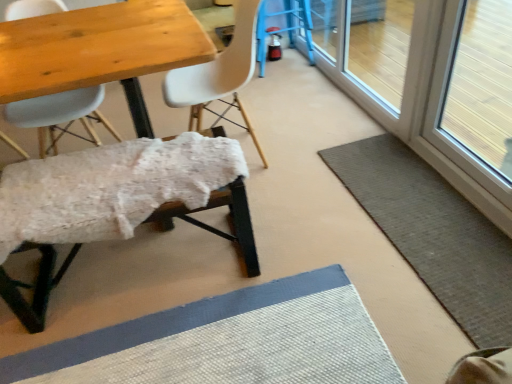
This screenshot has height=384, width=512. What do you see at coordinates (385, 63) in the screenshot?
I see `transparent glass screen door at upper right` at bounding box center [385, 63].

Identify the location of matte white chair at upper left, the third chair when ordered from right to left. (60, 116).

Measure the distance between point (20, 116) and camera.

Point (20, 116) and camera are 1.88 meters apart.

The width and height of the screenshot is (512, 384). In order to click on white fluffy bench at lower left, placed as the 2th chair when sorted from right to left in this screenshot , I will do `click(215, 228)`.

The image size is (512, 384). I want to click on transparent glass window screen at right, so click(x=475, y=94).

The height and width of the screenshot is (384, 512). What do you see at coordinates (433, 233) in the screenshot?
I see `gray woven bath mat at lower right` at bounding box center [433, 233].

Measure the distance between gray woven bath mat at lower right and camera.

A distance of 4.31 feet exists between gray woven bath mat at lower right and camera.

Measure the distance between point (302, 17) and camera.

→ Point (302, 17) and camera are 10.10 feet apart.

Image resolution: width=512 pixels, height=384 pixels. I want to click on blue plastic bar stool at upper right, so click(284, 28).

Find the location of `transparent glass screen door at upper right`. transparent glass screen door at upper right is located at coordinates (385, 63).

Does point (501, 81) appear closer or farther from the camera than point (49, 95)?

Point (501, 81) appears to be farther away from the viewer than point (49, 95).

Consider the image. Would you say transparent glass window screen at right contains matte white chair at upper left, the third chair when ordered from right to left?

No, matte white chair at upper left, the third chair when ordered from right to left, is not a part of transparent glass window screen at right.

From a real-world perspective, who is located lower, transparent glass window screen at right or matte white chair at upper left, marked as the 1th chair in a left-to-right arrangement?

transparent glass window screen at right, from a real-world perspective.

Which is behind, transparent glass window screen at right or matte white chair at upper left, the third chair when ordered from right to left?

matte white chair at upper left, the third chair when ordered from right to left, is behind.

Does transparent glass window screen at right come behind gray woven bath mat at lower right?

No.

Is transparent glass window screen at right smaller than gray woven bath mat at lower right?

No, transparent glass window screen at right is not smaller than gray woven bath mat at lower right.

Which is in front, point (434, 130) or point (328, 148)?

The point (434, 130) is closer to the camera.

Is gray woven bath mat at lower right surrounded by transparent glass window screen at right?

No, gray woven bath mat at lower right is not surrounded by transparent glass window screen at right.

Is blue plastic bar stool at upper right directly adjacent to white fluffy bench at lower left, placed as the 2th chair when sorted from right to left?

No, blue plastic bar stool at upper right is not next to white fluffy bench at lower left, placed as the 2th chair when sorted from right to left.

From the image's perspective, would you say blue plastic bar stool at upper right is shown under white fluffy bench at lower left, the second chair when ordered from left to right?

Actually, blue plastic bar stool at upper right appears above white fluffy bench at lower left, the second chair when ordered from left to right, in the image.

Considering the positions of objects blue plastic bar stool at upper right and white fluffy bench at lower left, the second chair when ordered from left to right, in the image provided, who is in front, blue plastic bar stool at upper right or white fluffy bench at lower left, the second chair when ordered from left to right,?

white fluffy bench at lower left, the second chair when ordered from left to right, is closer to the camera.

Which is more to the left, gray woven bath mat at lower right or blue plastic bar stool at upper right?

blue plastic bar stool at upper right.

Is gray woven bath mat at lower right turned away from blue plastic bar stool at upper right?

No, gray woven bath mat at lower right is not facing away from blue plastic bar stool at upper right.

From the image's perspective, which is below, gray woven bath mat at lower right or blue plastic bar stool at upper right?

gray woven bath mat at lower right.

Is there a large distance between gray woven bath mat at lower right and blue plastic bar stool at upper right?

Yes, gray woven bath mat at lower right and blue plastic bar stool at upper right are quite far apart.

Considering the sizes of objects white fluffy bench at lower left, placed as the 2th chair when sorted from right to left, and matte white chair at upper left, the third chair when ordered from right to left, in the image provided, who is bigger, white fluffy bench at lower left, placed as the 2th chair when sorted from right to left, or matte white chair at upper left, the third chair when ordered from right to left,?

Bigger between the two is white fluffy bench at lower left, placed as the 2th chair when sorted from right to left.

In the image, is white fluffy bench at lower left, placed as the 2th chair when sorted from right to left, positioned in front of or behind matte white chair at upper left, the third chair when ordered from right to left?

In the image, white fluffy bench at lower left, placed as the 2th chair when sorted from right to left, appears in front of matte white chair at upper left, the third chair when ordered from right to left.

Considering the relative sizes of white fluffy bench at lower left, placed as the 2th chair when sorted from right to left, and matte white chair at upper left, the third chair when ordered from right to left, in the image provided, is white fluffy bench at lower left, placed as the 2th chair when sorted from right to left, shorter than matte white chair at upper left, the third chair when ordered from right to left,?

Yes.

In order to click on chair that appears below the white matte chair at center, which is the first chair from right to left (from a real-world perspective) in this screenshot , I will do (x=215, y=228).

Consider the image. Is white matte chair at center, which is the first chair from right to left, bigger than white fluffy bench at lower left, the second chair when ordered from left to right?

Yes, white matte chair at center, which is the first chair from right to left, is bigger than white fluffy bench at lower left, the second chair when ordered from left to right.

Is white matte chair at center, positioned as the 3th chair in left-to-right order, touching white fluffy bench at lower left, the second chair when ordered from left to right?

No, white matte chair at center, positioned as the 3th chair in left-to-right order, is not touching white fluffy bench at lower left, the second chair when ordered from left to right.

From the image's perspective, which one is positioned lower, white matte chair at center, positioned as the 3th chair in left-to-right order, or white fluffy bench at lower left, placed as the 2th chair when sorted from right to left?

white fluffy bench at lower left, placed as the 2th chair when sorted from right to left, is shown below in the image.

I want to click on the 3rd chair to the left of the transparent glass screen door at upper right, starting your count from the anchor, so click(60, 116).

Is point (6, 119) closer to viewer compared to point (426, 52)?

No, (6, 119) is further to viewer.

Considering the relative positions of matte white chair at upper left, marked as the 1th chair in a left-to-right arrangement, and transparent glass screen door at upper right in the image provided, is matte white chair at upper left, marked as the 1th chair in a left-to-right arrangement, in front of transparent glass screen door at upper right?

That is True.

Locate an element on the screen. This screenshot has width=512, height=384. the 3rd chair behind the transparent glass window screen at right, counting from the anchor's position is located at coordinates (60, 116).

This screenshot has width=512, height=384. Identify the location of window screen in front of the gray woven bath mat at lower right. tap(475, 94).

Looking at the image, which one is located further to transparent glass screen door at upper right, matte white chair at upper left, marked as the 1th chair in a left-to-right arrangement, or white fluffy bench at lower left, the second chair when ordered from left to right?

matte white chair at upper left, marked as the 1th chair in a left-to-right arrangement, lies further to transparent glass screen door at upper right than the other object.

Considering their positions, is transparent glass window screen at right positioned closer to transparent glass screen door at upper right than white fluffy bench at lower left, the second chair when ordered from left to right?

Based on the image, transparent glass window screen at right appears to be nearer to transparent glass screen door at upper right.

Estimate the real-world distances between objects in this image. Which object is closer to white matte chair at center, positioned as the 3th chair in left-to-right order, white fluffy bench at lower left, placed as the 2th chair when sorted from right to left, or matte white chair at upper left, marked as the 1th chair in a left-to-right arrangement?

white fluffy bench at lower left, placed as the 2th chair when sorted from right to left.

When comparing their distances from transparent glass screen door at upper right, does blue plastic bar stool at upper right or matte white chair at upper left, marked as the 1th chair in a left-to-right arrangement, seem further?

The object further to transparent glass screen door at upper right is matte white chair at upper left, marked as the 1th chair in a left-to-right arrangement.

Estimate the real-world distances between objects in this image. Which object is closer to transparent glass screen door at upper right, white matte chair at center, which is the first chair from right to left, or blue plastic bar stool at upper right?

blue plastic bar stool at upper right is closer to transparent glass screen door at upper right.

Based on their spatial positions, is matte white chair at upper left, the third chair when ordered from right to left, or white fluffy bench at lower left, the second chair when ordered from left to right, closer to transparent glass window screen at right?

white fluffy bench at lower left, the second chair when ordered from left to right, is closer to transparent glass window screen at right.

From the image, which object appears to be nearer to gray woven bath mat at lower right, matte white chair at upper left, the third chair when ordered from right to left, or transparent glass window screen at right?

transparent glass window screen at right is closer to gray woven bath mat at lower right.

From the image, which object appears to be farther from white fluffy bench at lower left, the second chair when ordered from left to right, gray woven bath mat at lower right or white matte chair at center, positioned as the 3th chair in left-to-right order?

gray woven bath mat at lower right is further to white fluffy bench at lower left, the second chair when ordered from left to right.

At what (x,y) coordinates should I click in order to perform the action: click on bar stool located between matte white chair at upper left, marked as the 1th chair in a left-to-right arrangement, and transparent glass window screen at right in the left-right direction. Please return your answer as a coordinate pair (x, y). This screenshot has height=384, width=512. Looking at the image, I should click on (284, 28).

The height and width of the screenshot is (384, 512). Find the location of `bath mat between white fluffy bench at lower left, the second chair when ordered from left to right, and transparent glass window screen at right from left to right`. bath mat between white fluffy bench at lower left, the second chair when ordered from left to right, and transparent glass window screen at right from left to right is located at coordinates (433, 233).

The image size is (512, 384). What are the coordinates of `bath mat between white matte chair at center, which is the first chair from right to left, and transparent glass window screen at right` in the screenshot? It's located at (433, 233).

Identify the location of screen door between white fluffy bench at lower left, the second chair when ordered from left to right, and gray woven bath mat at lower right. This screenshot has width=512, height=384. (385, 63).